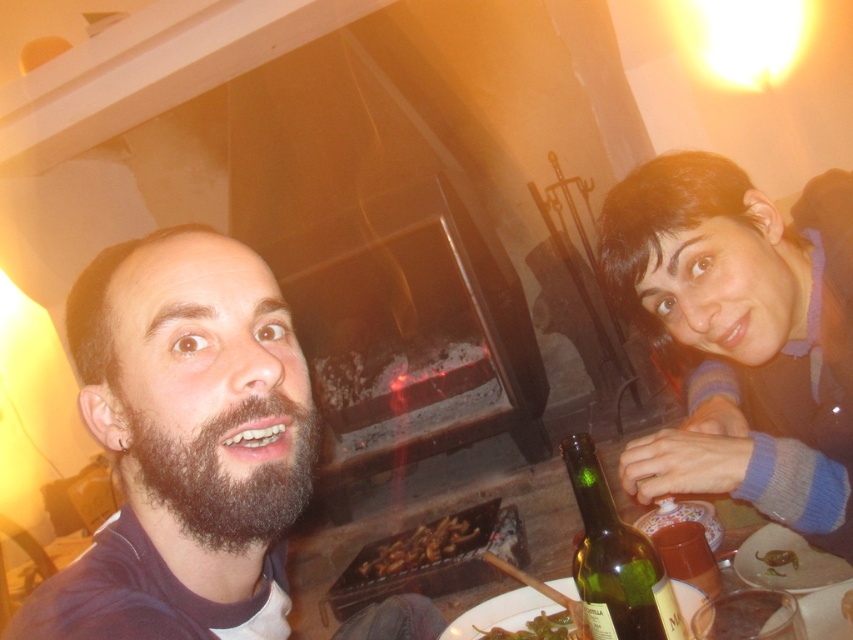
Does green glass bottle at lower right appear on the left side of shiny brown meat at lower right?

Correct, you'll find green glass bottle at lower right to the left of shiny brown meat at lower right.

Which is more to the right, green glass bottle at lower right or shiny brown meat at lower right?

Positioned to the right is shiny brown meat at lower right.

Is point (593, 600) farther from viewer compared to point (782, 573)?

No, it is in front of (782, 573).

This screenshot has height=640, width=853. In order to click on green glass bottle at lower right in this screenshot , I will do `click(614, 561)`.

Does dark brown beard at center appear over shiny brown meat at lower right?

Yes, dark brown beard at center is above shiny brown meat at lower right.

How much distance is there between dark brown beard at center and shiny brown meat at lower right?

A distance of 25.32 inches exists between dark brown beard at center and shiny brown meat at lower right.

Who is more distant from viewer, (x=144, y=401) or (x=766, y=556)?

Point (x=766, y=556)

Where is `dark brown beard at center`? The image size is (853, 640). dark brown beard at center is located at coordinates (184, 444).

From the picture: Between smooth blue sweater at right and green leafy vegetable at lower center, which one is positioned higher?

Positioned higher is smooth blue sweater at right.

Locate an element on the screen. This screenshot has width=853, height=640. smooth blue sweater at right is located at coordinates (741, 337).

Measure the distance between point (631, 452) and camera.

Point (631, 452) and camera are 32.84 inches apart from each other.

Image resolution: width=853 pixels, height=640 pixels. Find the location of `smooth blue sweater at right`. smooth blue sweater at right is located at coordinates (741, 337).